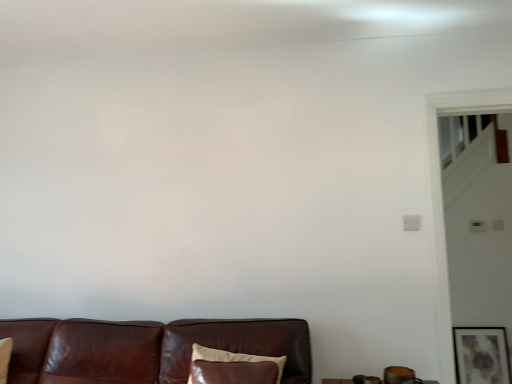
You are a GUI agent. You are given a task and a screenshot of the screen. Output one action in this format:
    pyautogui.click(x=<x>, y=<y>)
    Task: Click on the vacant area on top of matte gray painting at lower right (from a real-world perspective)
    
    Given the screenshot: What is the action you would take?
    pyautogui.click(x=481, y=330)